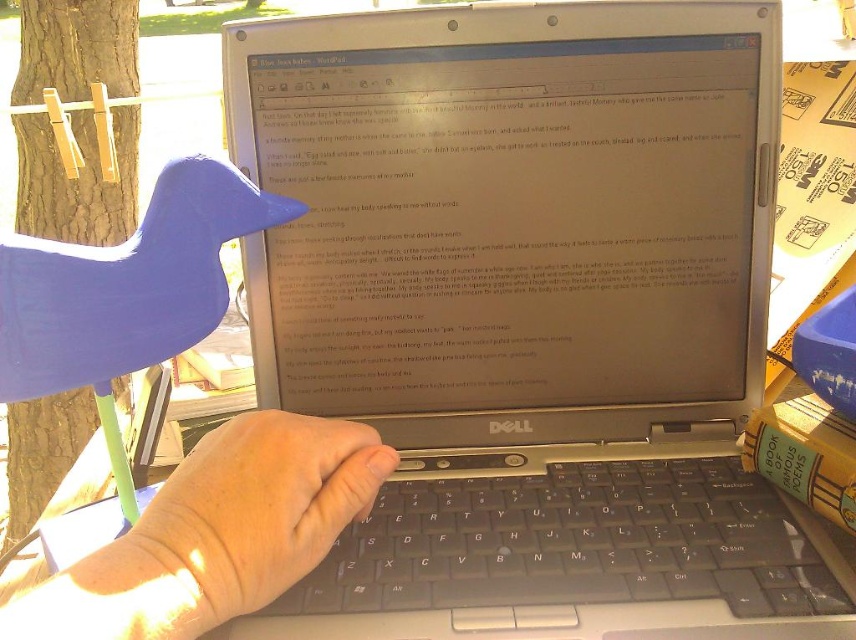
Based on the photo, is black plastic keyboard at center to the left of skinny white hand at center from the viewer's perspective?

Incorrect, black plastic keyboard at center is not on the left side of skinny white hand at center.

Between black plastic keyboard at center and skinny white hand at center, which one is positioned higher?

Positioned higher is skinny white hand at center.

Is point (587, 529) positioned before point (177, 497)?

No, (587, 529) is behind (177, 497).

Where is `black plastic keyboard at center`? black plastic keyboard at center is located at coordinates (575, 544).

Which is in front, point (596, 60) or point (812, 586)?

Point (812, 586) is in front.

Who is taller, silver metallic laptop at center or black plastic keyboard at center?

silver metallic laptop at center

Between point (272, 54) and point (443, 508), which one is positioned in front?

Positioned in front is point (443, 508).

Identify the location of silver metallic laptop at center. Image resolution: width=856 pixels, height=640 pixels. (507, 224).

Is point (402, 269) in front of point (224, 593)?

No, it is not.

Based on the photo, is silver metallic laptop at center positioned in front of skinny white hand at center?

No.

Does point (311, 64) lie behind point (195, 472)?

Yes, it is behind point (195, 472).

Where is `silver metallic laptop at center`? Image resolution: width=856 pixels, height=640 pixels. silver metallic laptop at center is located at coordinates (507, 224).